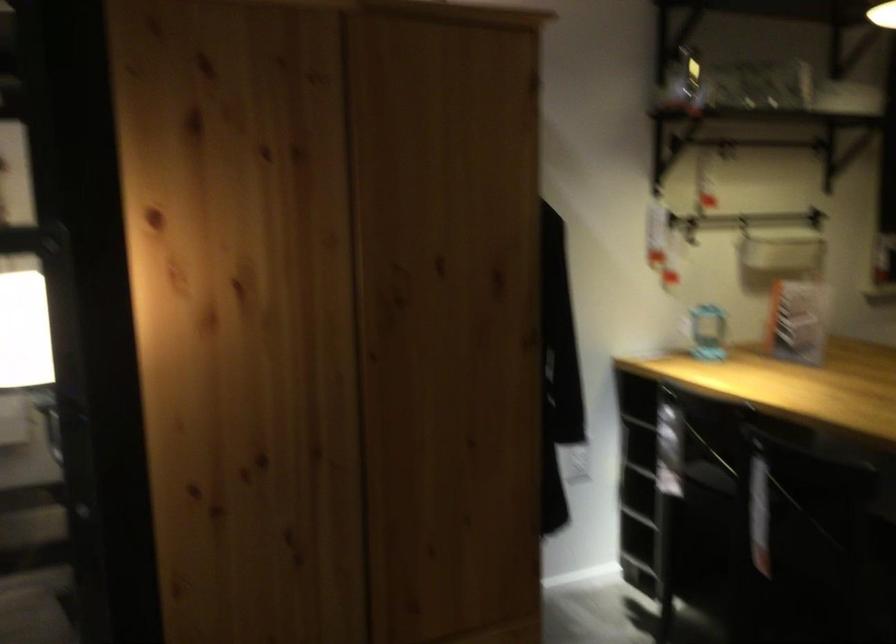
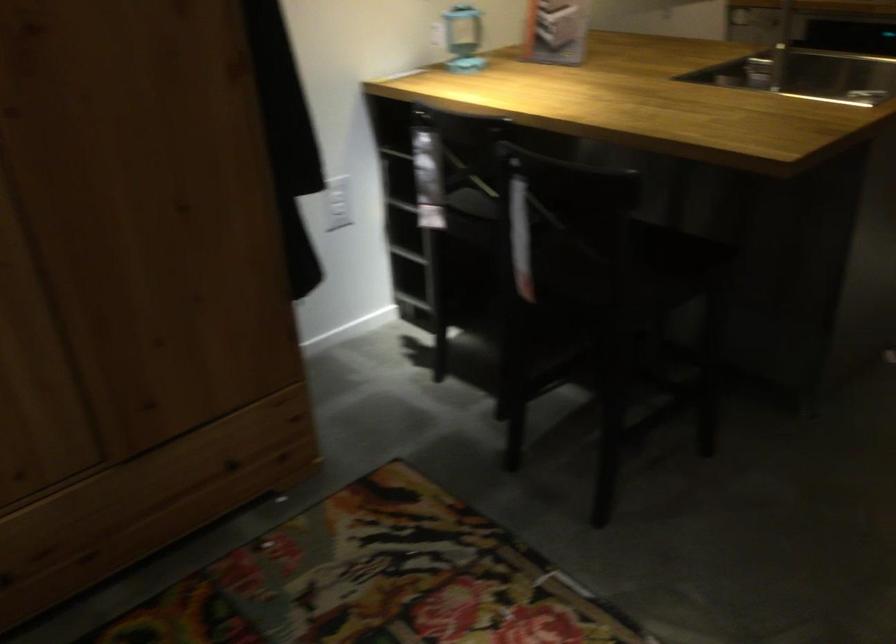
Consider the image. How did the camera likely rotate?

The camera rotated toward right-down.